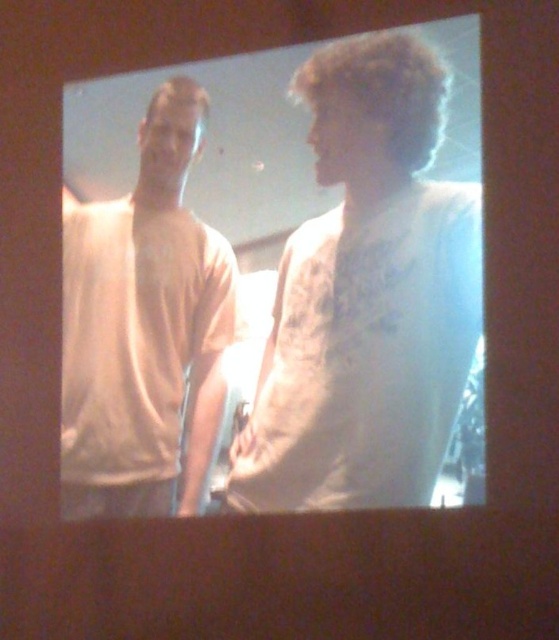
Does white textured shirt at center have a lesser height compared to white matte t-shirt at left?

No.

Can you confirm if white textured shirt at center is positioned above white matte t-shirt at left?

Yes.

What do you see at coordinates (367, 298) in the screenshot? I see `white textured shirt at center` at bounding box center [367, 298].

Image resolution: width=559 pixels, height=640 pixels. Find the location of `white textured shirt at center`. white textured shirt at center is located at coordinates (367, 298).